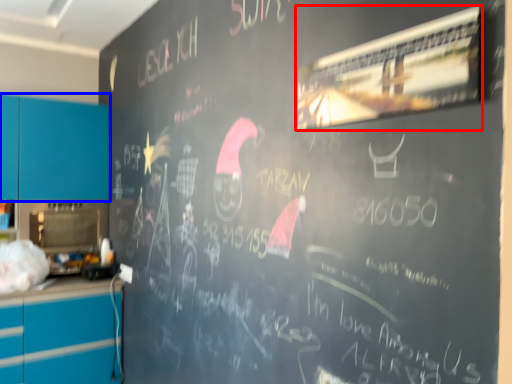
Question: Which object is further to the camera taking this photo, bulletin board (highlighted by a red box) or cabinetry (highlighted by a blue box)?

Choices:
 (A) bulletin board
 (B) cabinetry

Answer: (B)